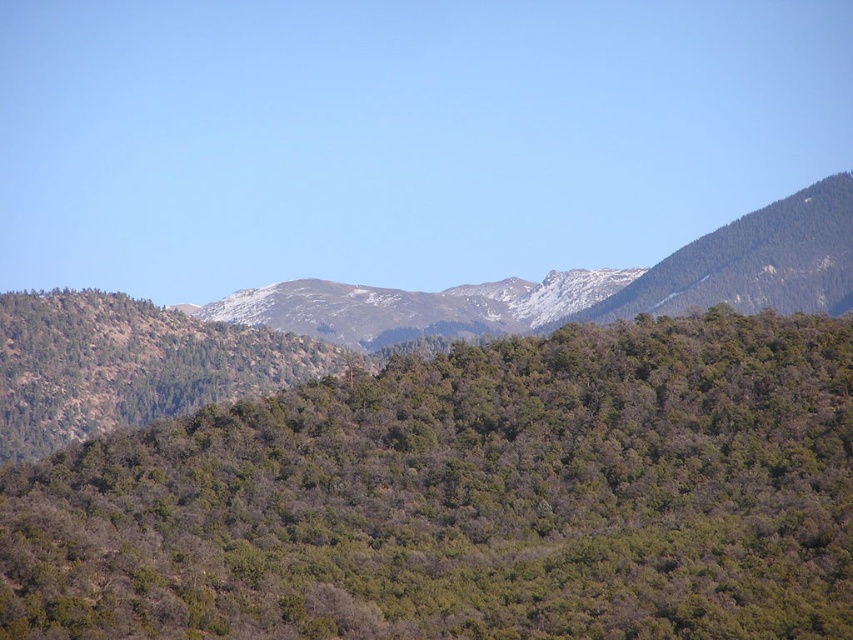
Question: Which of the following is the farthest from the observer?

Choices:
 (A) green leafy trees at center
 (B) snowy rocky mountain range at center

Answer: (B)

Question: From the image, what is the correct spatial relationship of green leafy forest at center in relation to snowy rocky mountain range at center?

Choices:
 (A) left
 (B) right

Answer: (A)

Question: Considering the real-world distances, which object is closest to the snowy rocky mountain range at center?

Choices:
 (A) green leafy trees at center
 (B) green leafy forest at center

Answer: (B)

Question: Estimate the real-world distances between objects in this image. Which object is closer to the green leafy trees at center?

Choices:
 (A) green leafy forest at center
 (B) snowy rocky mountain range at center

Answer: (A)

Question: Can you confirm if green leafy trees at center is thinner than snowy rocky mountain range at center?

Choices:
 (A) no
 (B) yes

Answer: (B)

Question: Is green leafy trees at center wider than snowy rocky mountain range at center?

Choices:
 (A) no
 (B) yes

Answer: (A)